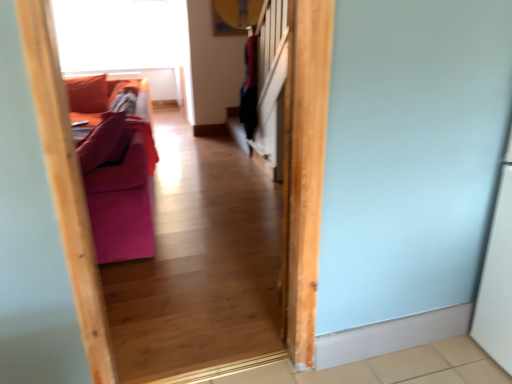
Question: Could you tell me if transparent glass window screen at upper left is facing matte purple couch at left?

Choices:
 (A) yes
 (B) no

Answer: (A)

Question: Is transparent glass window screen at upper left located outside matte purple couch at left?

Choices:
 (A) yes
 (B) no

Answer: (A)

Question: Is transparent glass window screen at upper left next to matte purple couch at left and touching it?

Choices:
 (A) no
 (B) yes

Answer: (A)

Question: From the image's perspective, is transparent glass window screen at upper left over matte purple couch at left?

Choices:
 (A) yes
 (B) no

Answer: (A)

Question: Considering the relative sizes of transparent glass window screen at upper left and matte purple couch at left in the image provided, is transparent glass window screen at upper left shorter than matte purple couch at left?

Choices:
 (A) no
 (B) yes

Answer: (A)

Question: Can you confirm if transparent glass window screen at upper left is thinner than matte purple couch at left?

Choices:
 (A) yes
 (B) no

Answer: (A)

Question: Is matte purple couch at left positioned behind transparent glass window screen at upper left?

Choices:
 (A) yes
 (B) no

Answer: (B)

Question: Is matte purple couch at left positioned before transparent glass window screen at upper left?

Choices:
 (A) yes
 (B) no

Answer: (A)

Question: From the image's perspective, is matte purple couch at left on top of transparent glass window screen at upper left?

Choices:
 (A) yes
 (B) no

Answer: (B)

Question: Is matte purple couch at left with transparent glass window screen at upper left?

Choices:
 (A) no
 (B) yes

Answer: (A)

Question: Is matte purple couch at left positioned far away from transparent glass window screen at upper left?

Choices:
 (A) yes
 (B) no

Answer: (A)

Question: Does matte purple couch at left have a greater width compared to transparent glass window screen at upper left?

Choices:
 (A) no
 (B) yes

Answer: (B)

Question: Considering their positions, is transparent glass window screen at upper left located in front of or behind matte purple couch at left?

Choices:
 (A) behind
 (B) front

Answer: (A)